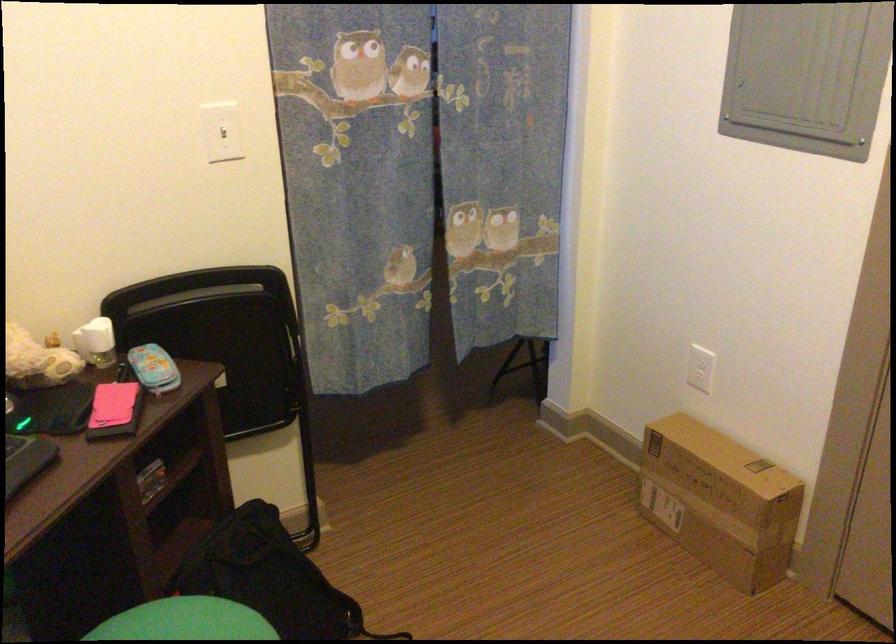
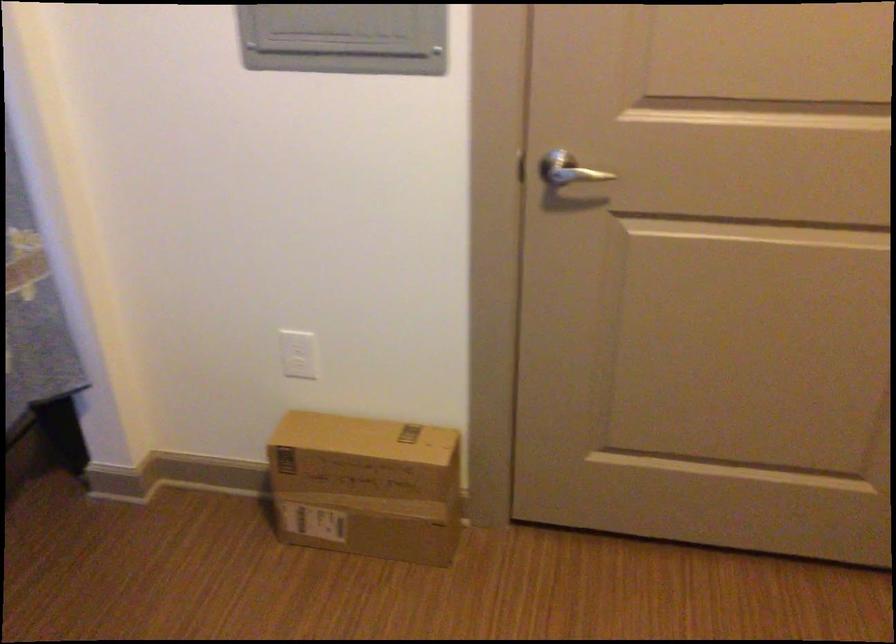
Question: How did the camera likely rotate?

Choices:
 (A) Left
 (B) Right
 (C) Up
 (D) Down

Answer: (B)